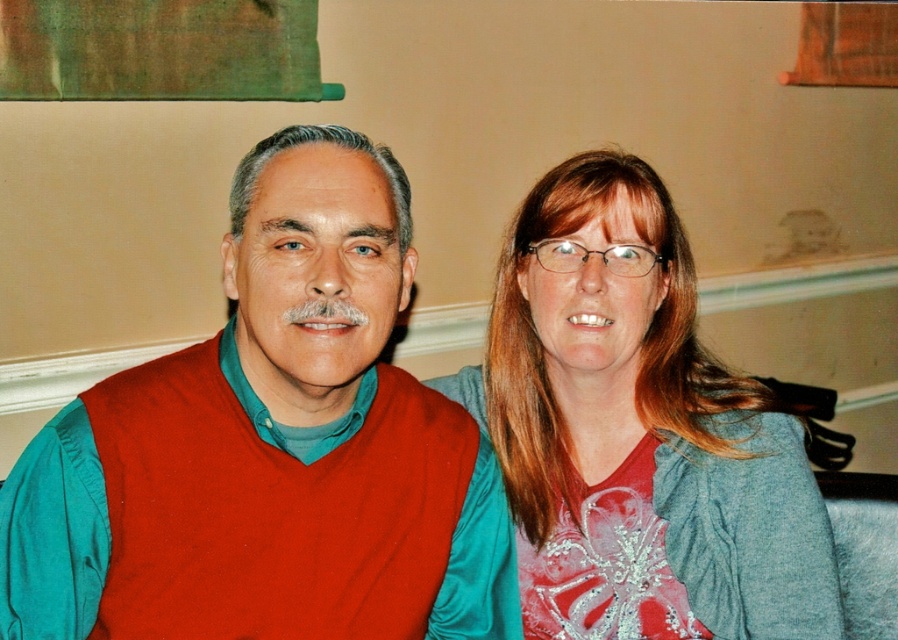
Is matte red shirt at center taller than matte red vest at center?

Indeed, matte red shirt at center has a greater height compared to matte red vest at center.

How distant is matte red shirt at center from matte red vest at center?

11.02 inches

I want to click on matte red shirt at center, so click(x=638, y=435).